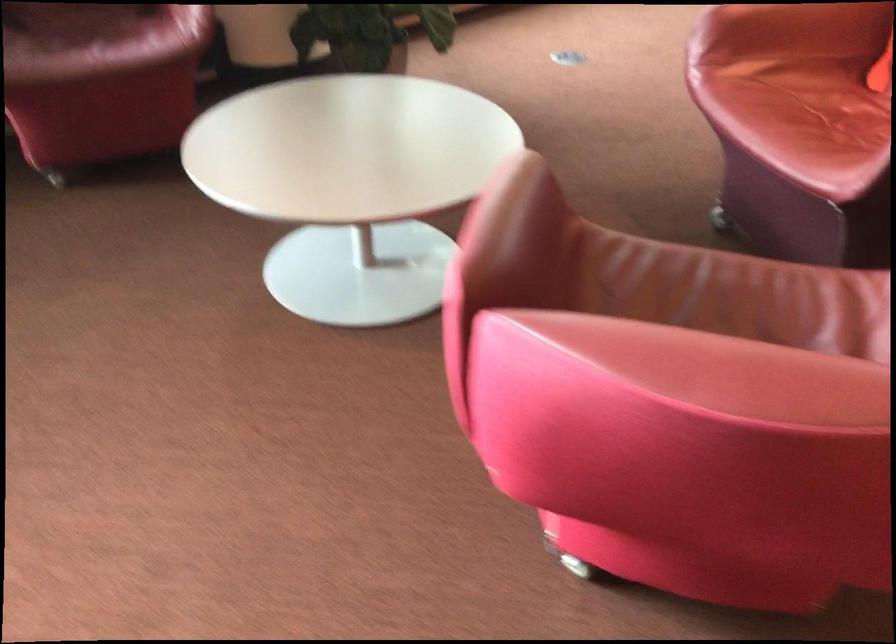
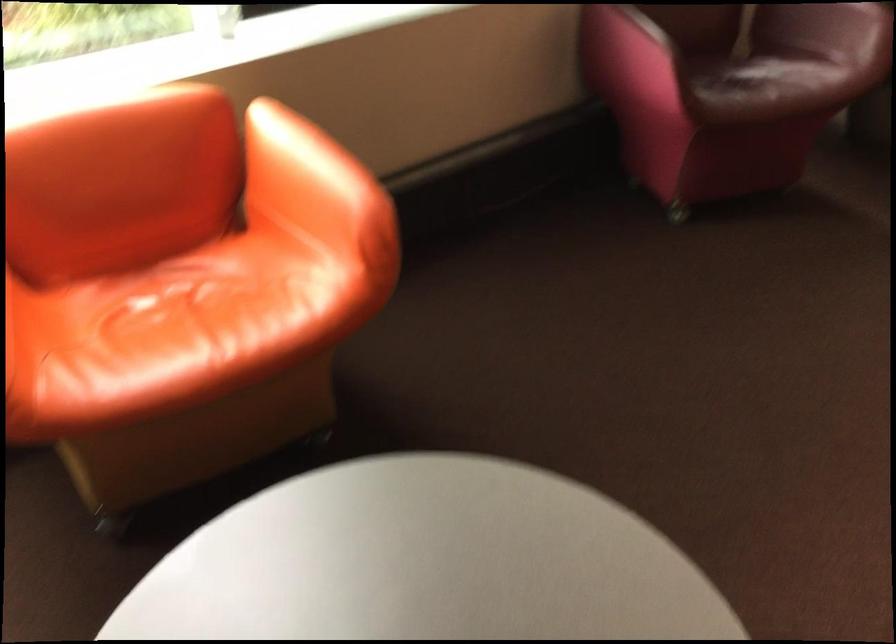
Question: In a continuous first-person perspective shot, in which direction is the camera moving?

Choices:
 (A) Left
 (B) Right
 (C) Forward
 (D) Backward

Answer: (A)